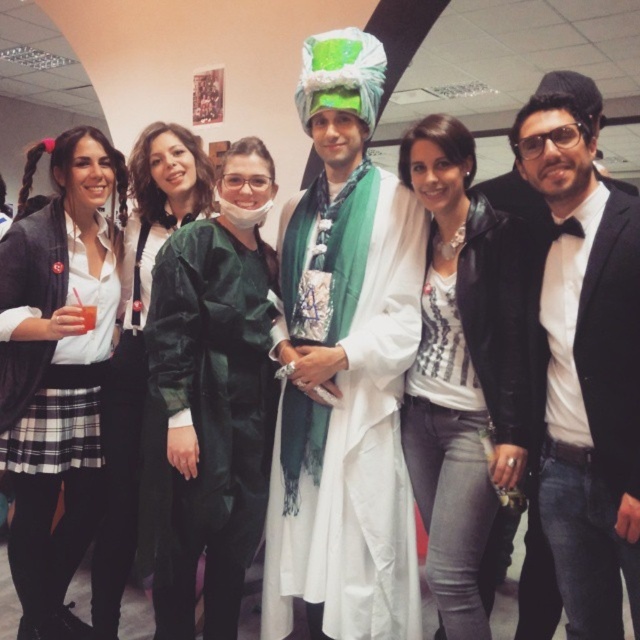
Does green fabric coat at center appear on the left side of matte green coat at center?

Incorrect, green fabric coat at center is not on the left side of matte green coat at center.

Between point (224, 323) and point (129, 387), which one is positioned in front?

Point (224, 323) is in front.

Which is in front, point (198, 426) or point (138, 525)?

Positioned in front is point (198, 426).

At what (x,y) coordinates should I click in order to perform the action: click on green fabric coat at center. Please return your answer as a coordinate pair (x, y). The height and width of the screenshot is (640, 640). Looking at the image, I should click on (212, 396).

Can you confirm if green fabric coat at center is taller than white matte shirt at upper left?

In fact, green fabric coat at center may be shorter than white matte shirt at upper left.

Is point (164, 403) in front of point (58, 548)?

Yes, point (164, 403) is in front of point (58, 548).

The image size is (640, 640). Identify the location of green fabric coat at center. (212, 396).

Find the location of a particular element. green fabric coat at center is located at coordinates (212, 396).

Can you confirm if matte white coat at center is positioned to the left of white matte shirt at upper left?

Incorrect, matte white coat at center is not on the left side of white matte shirt at upper left.

Is point (378, 483) positioned behind point (76, 164)?

No, (378, 483) is in front of (76, 164).

Locate an element on the screen. The image size is (640, 640). matte white coat at center is located at coordinates (344, 368).